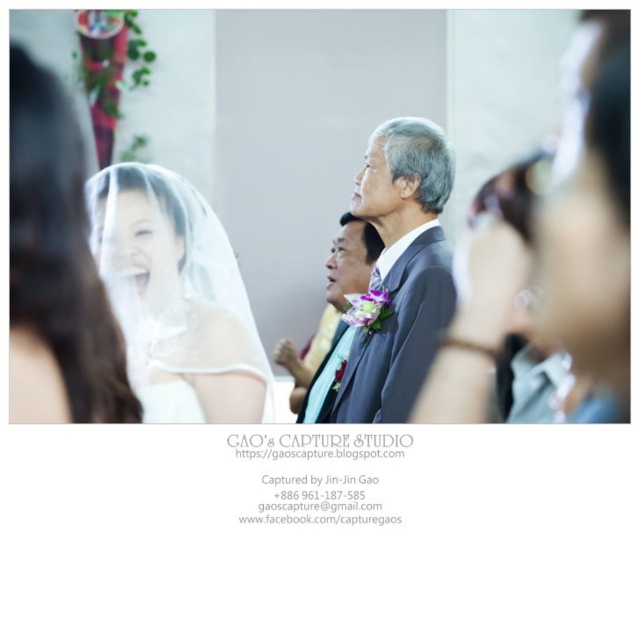
You are a photographer at the wedding. You want to capture a closeup shot of the white sheer veil at left and the satin black suit at center. Which object should you focus on first to ensure both are in focus?

The white sheer veil at left is closer to the viewer than the satin black suit at center, so focus on the white sheer veil at left first to ensure both are in focus.

You are a photographer at the wedding and want to capture the bride and her father. The bride has two veils, the white satin veil at upper left and the white sheer veil at upper left. Which veil should you focus on if you want to highlight the one that is taller?

The white satin veil at upper left is taller than the white sheer veil at upper left, so you should focus on the white satin veil at upper left to highlight the taller one.